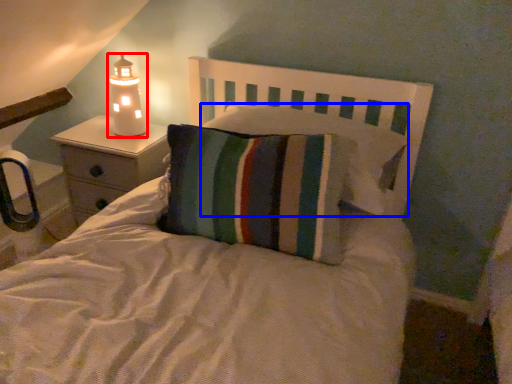
Question: Which point is further to the camera, lamp (highlighted by a red box) or pillow (highlighted by a blue box)?

Choices:
 (A) lamp
 (B) pillow

Answer: (A)